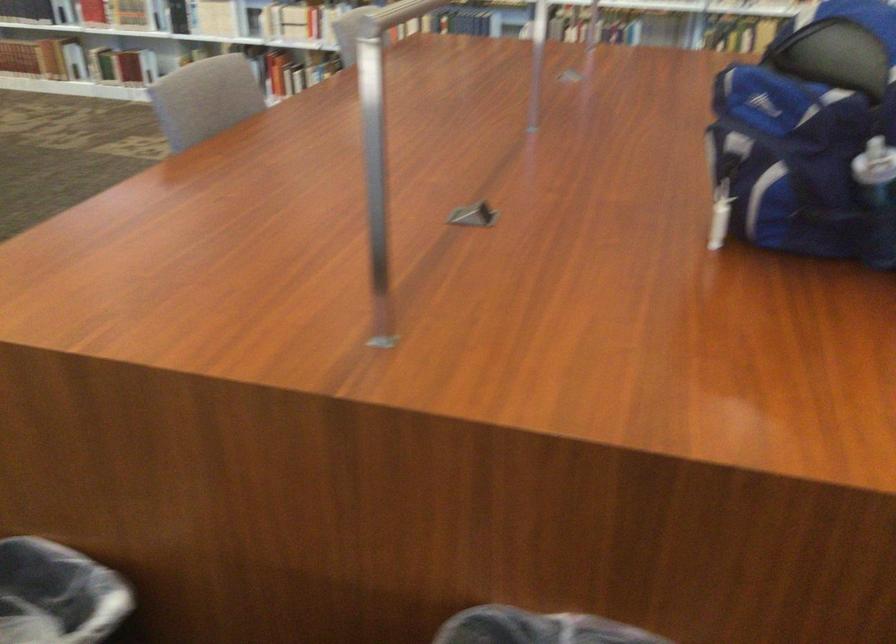
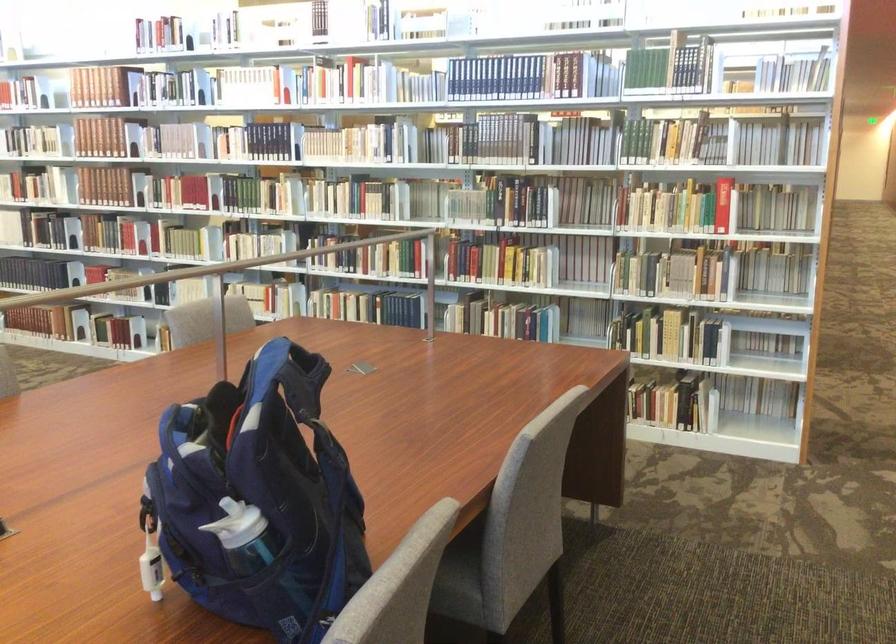
Question: The images are taken continuously from a first-person perspective. In which direction are you moving?

Choices:
 (A) Left
 (B) Right
 (C) Forward
 (D) Backward

Answer: (B)